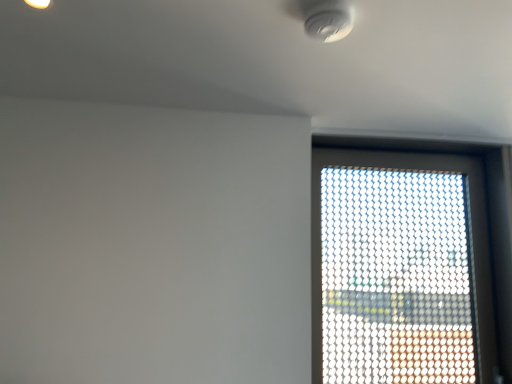
Question: Is white plastic smoke detector at upper center outside transparent mesh window at upper right?

Choices:
 (A) no
 (B) yes

Answer: (B)

Question: Is white plastic smoke detector at upper center with transparent mesh window at upper right?

Choices:
 (A) no
 (B) yes

Answer: (A)

Question: Is transparent mesh window at upper right at the back of white plastic smoke detector at upper center?

Choices:
 (A) yes
 (B) no

Answer: (B)

Question: Is white plastic smoke detector at upper center to the left of transparent mesh window at upper right from the viewer's perspective?

Choices:
 (A) yes
 (B) no

Answer: (A)

Question: From the image's perspective, is white plastic smoke detector at upper center on top of transparent mesh window at upper right?

Choices:
 (A) no
 (B) yes

Answer: (B)

Question: Is white plastic smoke detector at upper center at the right side of transparent mesh window at upper right?

Choices:
 (A) no
 (B) yes

Answer: (A)

Question: From the image's perspective, would you say transparent mesh window at upper right is positioned over white plastic smoke detector at upper center?

Choices:
 (A) no
 (B) yes

Answer: (A)

Question: Does transparent mesh window at upper right have a smaller size compared to white plastic smoke detector at upper center?

Choices:
 (A) no
 (B) yes

Answer: (A)

Question: Can you confirm if transparent mesh window at upper right is positioned to the left of white plastic smoke detector at upper center?

Choices:
 (A) no
 (B) yes

Answer: (A)

Question: Does transparent mesh window at upper right have a lesser width compared to white plastic smoke detector at upper center?

Choices:
 (A) no
 (B) yes

Answer: (B)

Question: Is transparent mesh window at upper right surrounding white plastic smoke detector at upper center?

Choices:
 (A) no
 (B) yes

Answer: (A)

Question: From a real-world perspective, is transparent mesh window at upper right located beneath white plastic smoke detector at upper center?

Choices:
 (A) no
 (B) yes

Answer: (B)

Question: Considering the positions of white plastic smoke detector at upper center and transparent mesh window at upper right in the image, is white plastic smoke detector at upper center taller or shorter than transparent mesh window at upper right?

Choices:
 (A) tall
 (B) short

Answer: (B)